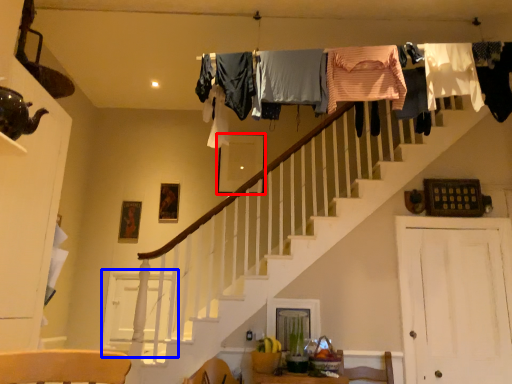
Question: Which object is closer to the camera taking this photo, picture frame (highlighted by a red box) or barn door (highlighted by a blue box)?

Choices:
 (A) picture frame
 (B) barn door

Answer: (B)